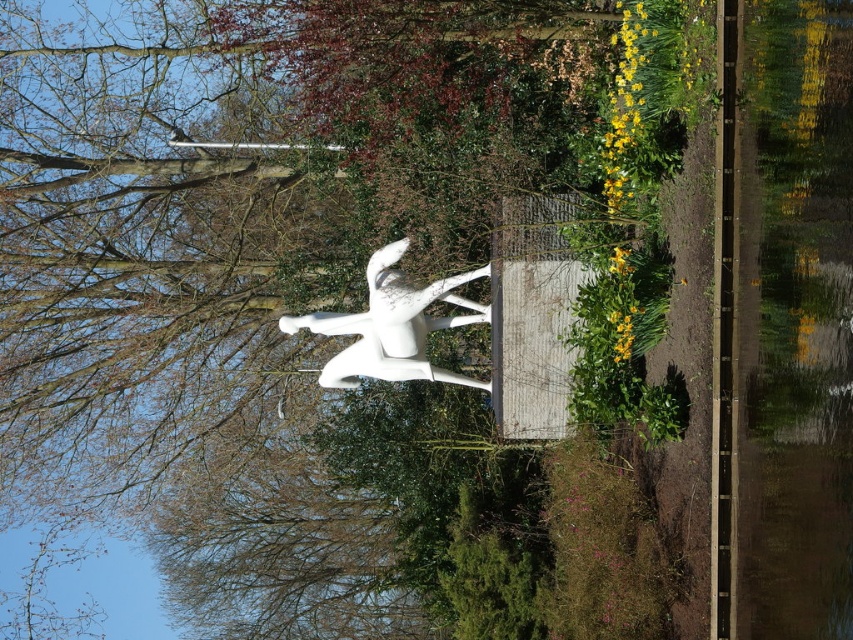
In the scene shown: You are standing in the garden and want to take a photo of the sculpture. If you move forward by 2 meters, how far will you be from the point marked at coordinates point (780,465)?

The point marked at coordinates point (780,465) is initially 9.93 meters away from you. If you move forward by 2 meters, your new distance to the point will be 9.93 meters minus 2 meters, resulting in 7.93 meters away.

You are an artist planning to paint this scene. You want to ensure the transparent glass water at right and the white glossy bird at center are positioned correctly in terms of depth. According to the scene, which object should appear closer to you?

The transparent glass water at right is closer to the viewer than the white glossy bird at center, so it should be painted to appear closer.

You are standing in the garden and notice a transparent glass water at right. Where exactly is the transparent glass water located in relation to the point marked at coordinates (793, 321)?

The transparent glass water at right is located exactly at the point marked at coordinates (793, 321).